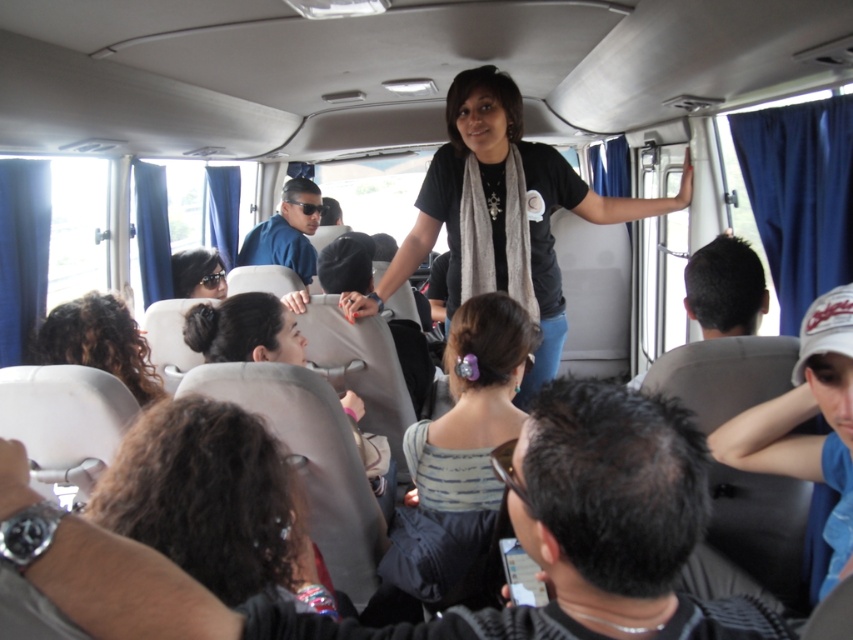
Question: Is dark brown hair at upper right below matte black sunglasses at lower left?

Choices:
 (A) yes
 (B) no

Answer: (A)

Question: Is curly hair at center above matte black sunglasses at lower left?

Choices:
 (A) no
 (B) yes

Answer: (A)

Question: Which object is positioned farthest from the curly hair at lower left?

Choices:
 (A) matte black sunglasses at lower left
 (B) matte blue shirt at center
 (C) striped fabric hair tie at center

Answer: (B)

Question: Which object is the closest to the dark brown hair at upper right?

Choices:
 (A) curly hair at center
 (B) blue fabric cap at right

Answer: (B)

Question: Estimate the real-world distances between objects in this image. Which object is farther from the striped fabric hair tie at center?

Choices:
 (A) matte blue shirt at center
 (B) blue fabric cap at right
 (C) dark brown leather jacket at lower center

Answer: (A)

Question: Does dark brown leather jacket at lower center have a greater width compared to curly hair at center?

Choices:
 (A) no
 (B) yes

Answer: (B)